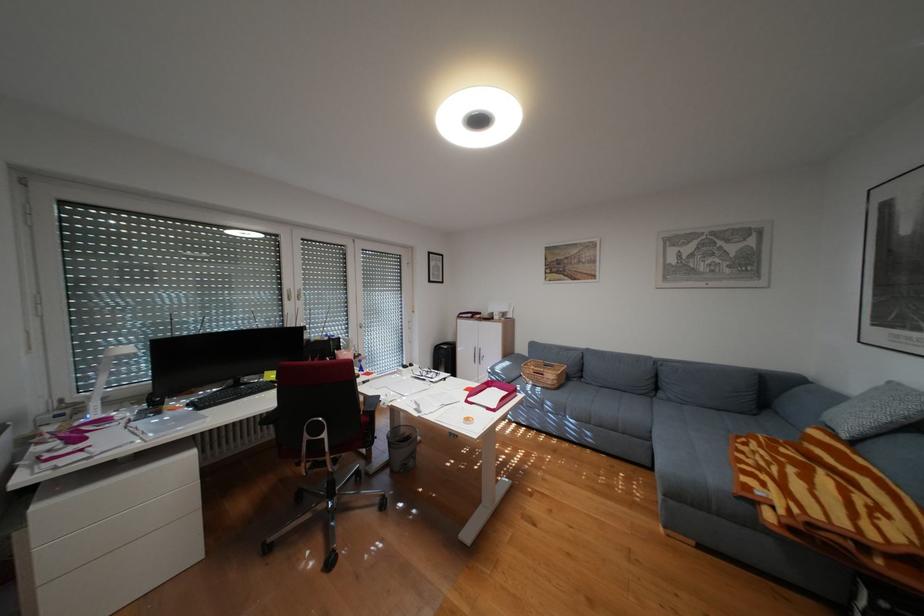
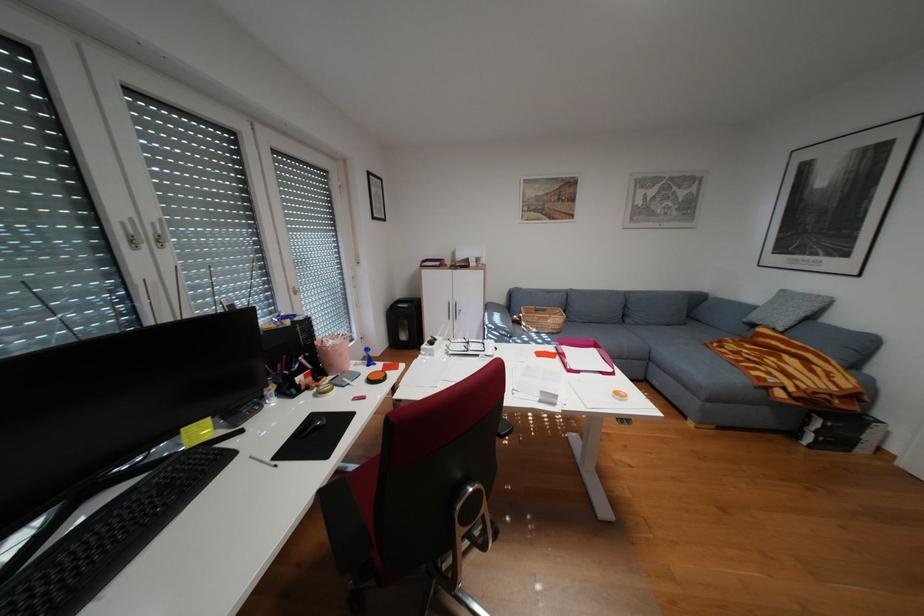
In the second image, find the point that corresponds to (305,299) in the first image.

(156, 245)